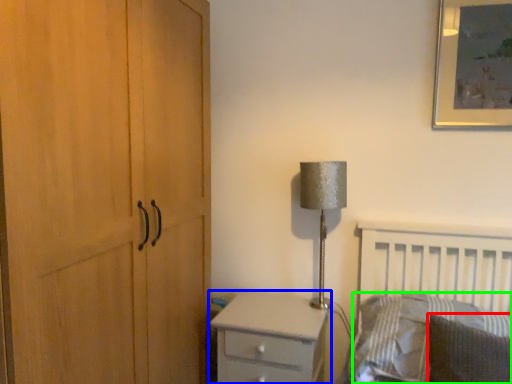
Question: Which object is the farthest from pillow (highlighted by a red box)? Choose among these: chest of drawers (highlighted by a blue box) or pillow (highlighted by a green box).

Choices:
 (A) chest of drawers
 (B) pillow

Answer: (A)